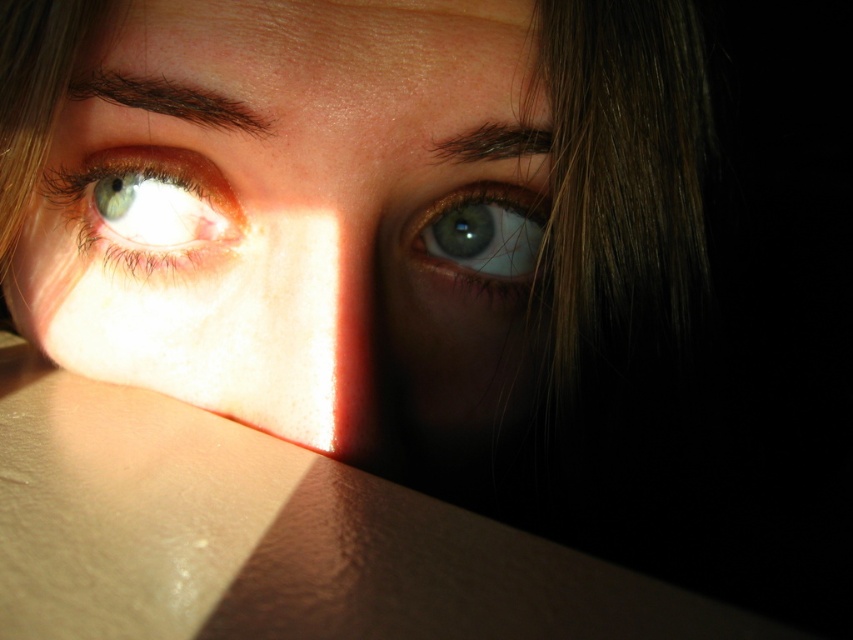
Is smooth skin face at center in front of green iridescent eye at upper center?

Yes, it is.

Is point (316, 4) more distant than point (531, 282)?

That is False.

Between point (500, 412) and point (459, 300), which one is positioned in front?

Positioned in front is point (459, 300).

This screenshot has width=853, height=640. I want to click on smooth skin face at center, so click(x=296, y=211).

Which is more to the right, smooth skin face at center or green glossy eye at upper left?

smooth skin face at center

Is point (213, 248) positioned in front of point (138, 275)?

Yes, point (213, 248) is closer to viewer.

Where is `smooth skin face at center`? The width and height of the screenshot is (853, 640). smooth skin face at center is located at coordinates (296, 211).

Does green glossy eye at upper left have a greater width compared to green iridescent eye at upper center?

Indeed, green glossy eye at upper left has a greater width compared to green iridescent eye at upper center.

Does green glossy eye at upper left have a smaller size compared to green iridescent eye at upper center?

Actually, green glossy eye at upper left might be larger than green iridescent eye at upper center.

Is point (218, 248) closer to viewer compared to point (511, 252)?

Yes.

The width and height of the screenshot is (853, 640). Identify the location of green glossy eye at upper left. (148, 208).